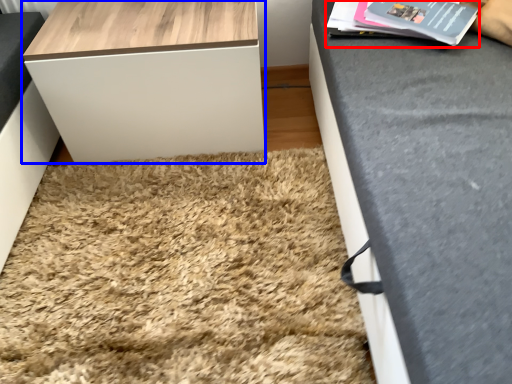
Question: Which object is closer to the camera taking this photo, magazine (highlighted by a red box) or table (highlighted by a blue box)?

Choices:
 (A) magazine
 (B) table

Answer: (A)